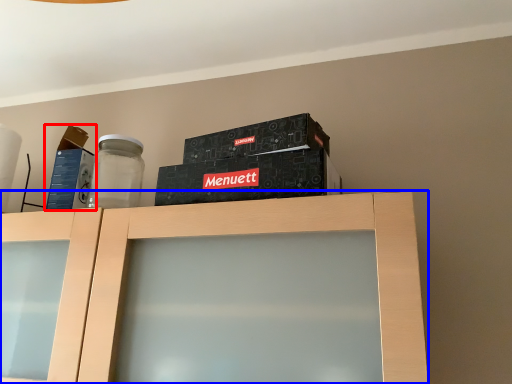
Question: Among these objects, which one is nearest to the camera, box (highlighted by a red box) or cabinetry (highlighted by a blue box)?

Choices:
 (A) box
 (B) cabinetry

Answer: (B)